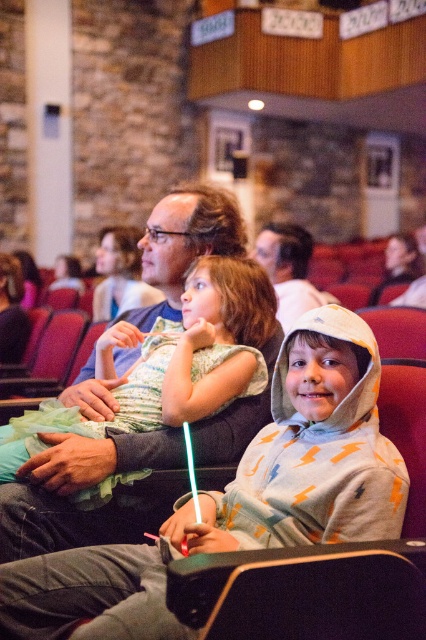
What is located at the coordinates point (x=195, y=349)?

A matte green dress is located at point (x=195, y=349).